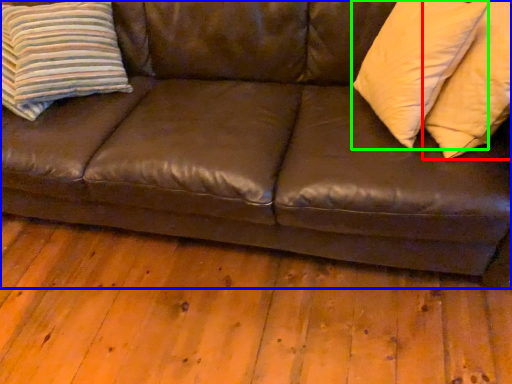
Question: Considering the real-world distances, which object is closest to pillow (highlighted by a red box)? studio couch (highlighted by a blue box) or pillow (highlighted by a green box).

Choices:
 (A) studio couch
 (B) pillow

Answer: (B)